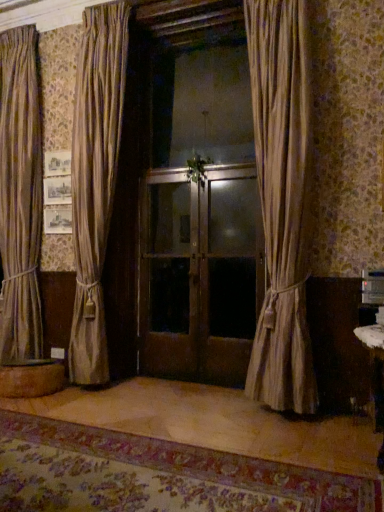
Question: Looking at their shapes, would you say wooden round table at lower left is wider or thinner than silky beige curtain at center, positioned as the 1th curtain in front-to-back order?

Choices:
 (A) thin
 (B) wide

Answer: (B)

Question: Looking at the image, does wooden round table at lower left seem bigger or smaller compared to silky beige curtain at center, positioned as the 1th curtain in front-to-back order?

Choices:
 (A) small
 (B) big

Answer: (A)

Question: Estimate the real-world distances between objects in this image. Which object is closer to the wooden round table at lower left?

Choices:
 (A) wooden door at center
 (B) matte brown curtain at center, the first curtain from the left
 (C) matte wooden screen door at center, acting as the first screen door starting from the right
 (D) brown wooden screen door at center, the 2th screen door viewed from the right
 (E) silky beige curtain at center, the 2th curtain in the left-to-right sequence

Answer: (B)

Question: Which object is positioned closest to the silky beige curtain at center, marked as the 1th curtain in a right-to-left arrangement?

Choices:
 (A) wooden round table at lower left
 (B) matte brown curtain at center, placed as the second curtain when sorted from front to back
 (C) wooden door at center
 (D) matte wooden screen door at center, the second screen door from the left
 (E) brown wooden screen door at center, the 1th screen door positioned from the left

Answer: (D)